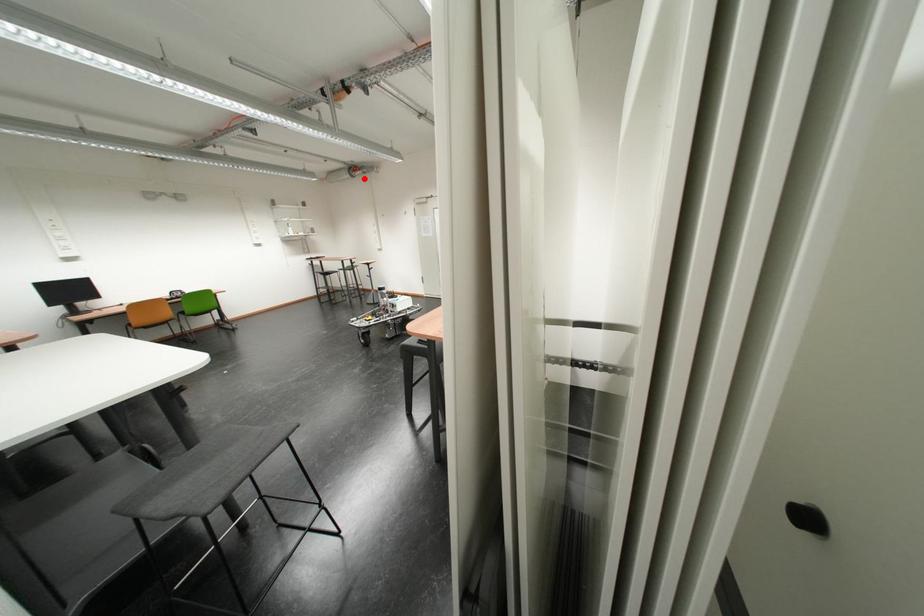
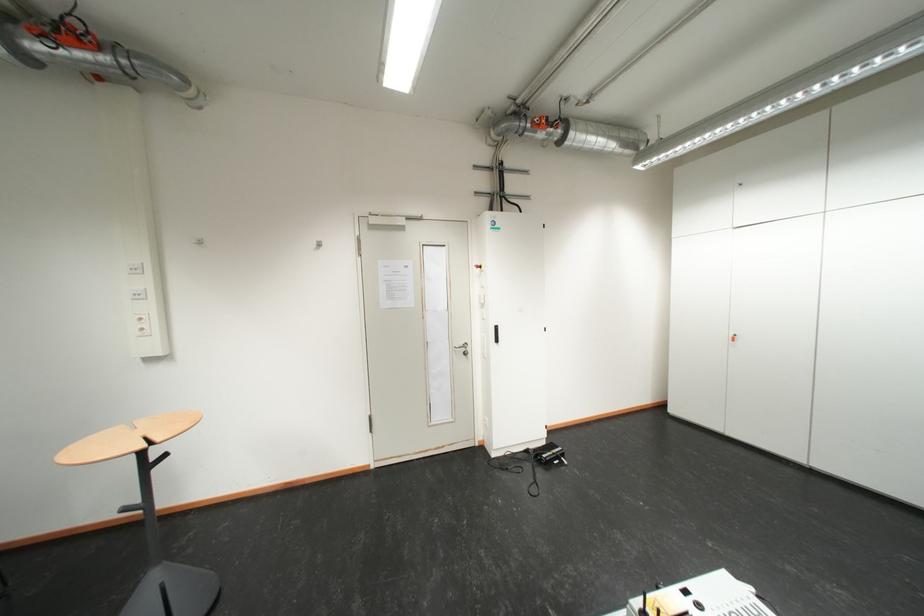
Question: I am providing you with two images of the same scene from different viewpoints. A red point is shown in image1. For the corresponding object point in image2, is it positioned nearer or farther from the camera?

Choices:
 (A) Nearer
 (B) Farther

Answer: (B)